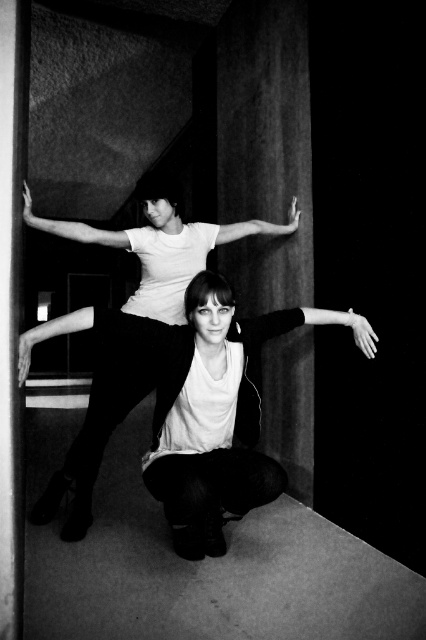
You are an architect designing a space that requires precise measurements. You observe two matte white arms in the image. Which one has a greater length when comparing the matte white arm at upper center and the matte white arm at center?

The matte white arm at upper center has a larger size compared to the matte white arm at center, so it has a greater length.

Consider the image. You are a photographer adjusting your camera settings to capture the two points in the image. Which point, point (201,493) or point (66,225), will appear larger in the photo?

Point (201,493) is closer to the camera than point (66,225), so it will appear larger in the photo.

You are an art curator examining this black and white photograph. You notice two arms in the composition. The smooth skin arm at upper left and the matte white arm at center. Which arm is closer to the viewer?

The smooth skin arm at upper left is closer to the viewer because it is positioned under the matte white arm at center, indicating it is in front spatially.